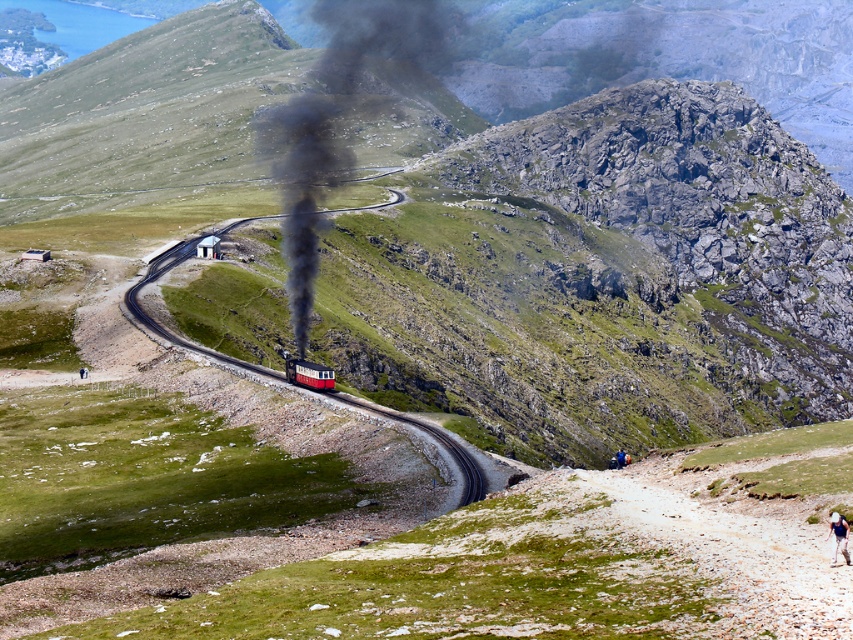
Based on the photo, is polished wood passenger train at center positioned before matte red train at center?

No, polished wood passenger train at center is behind matte red train at center.

Can you confirm if polished wood passenger train at center is wider than matte red train at center?

Indeed, polished wood passenger train at center has a greater width compared to matte red train at center.

Measure the distance between point (309, 380) and camera.

Point (309, 380) and camera are 123.65 meters apart.

The image size is (853, 640). What are the coordinates of `polished wood passenger train at center` in the screenshot? It's located at (306, 372).

Is point (753, 605) positioned behind point (328, 369)?

No, it is in front of (328, 369).

From the picture: Which of these two, green mossy dirt path at lower right or polished wood passenger train at center, stands shorter?

green mossy dirt path at lower right

Identify the location of green mossy dirt path at lower right. Image resolution: width=853 pixels, height=640 pixels. (738, 545).

Where is `green mossy dirt path at lower right`? green mossy dirt path at lower right is located at coordinates pos(738,545).

Who is more distant from viewer, (x=302, y=360) or (x=844, y=529)?

The point (x=302, y=360) is behind.

Does point (331, 387) lie in front of point (831, 516)?

No, it is behind (831, 516).

Where is `matte red train at center`? The height and width of the screenshot is (640, 853). matte red train at center is located at coordinates (308, 372).